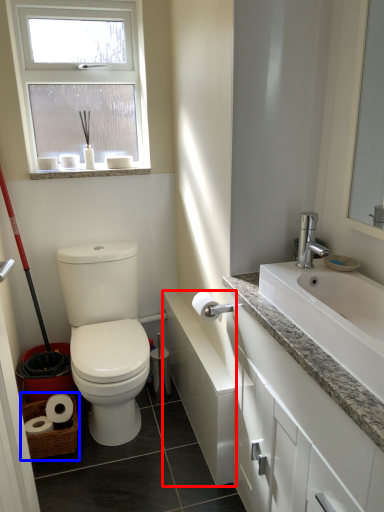
Question: Which point is further to the camera, bath (highlighted by a red box) or basket (highlighted by a blue box)?

Choices:
 (A) bath
 (B) basket

Answer: (B)